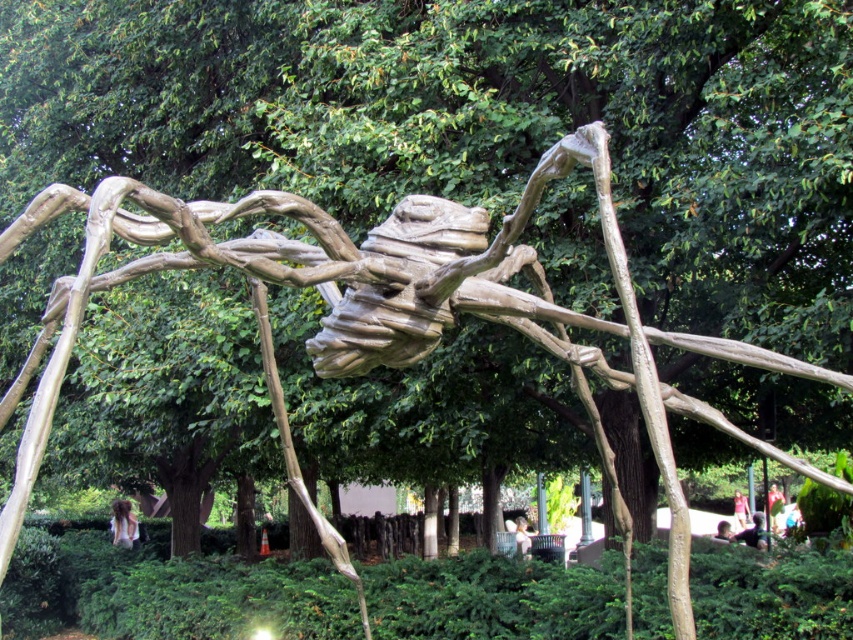
Question: Considering the real-world distances, which object is farthest from the yellow fabric dress at center?

Choices:
 (A) white fabric person at center
 (B) dark brown hair at lower right
 (C) brown hair at lower left

Answer: (C)

Question: Which is nearer to the brown hair at lower left?

Choices:
 (A) yellow fabric dress at center
 (B) white fabric person at center
 (C) dark brown hair at lower right

Answer: (B)

Question: Which point is farther from the camera taking this photo?

Choices:
 (A) (115, 509)
 (B) (744, 529)

Answer: (A)

Question: Can you confirm if brown hair at lower left is positioned above white fabric person at center?

Choices:
 (A) no
 (B) yes

Answer: (A)

Question: Can you confirm if brown hair at lower left is positioned to the right of dark brown hair at lower right?

Choices:
 (A) yes
 (B) no

Answer: (B)

Question: Does dark brown hair at lower right have a larger size compared to yellow fabric dress at center?

Choices:
 (A) no
 (B) yes

Answer: (B)